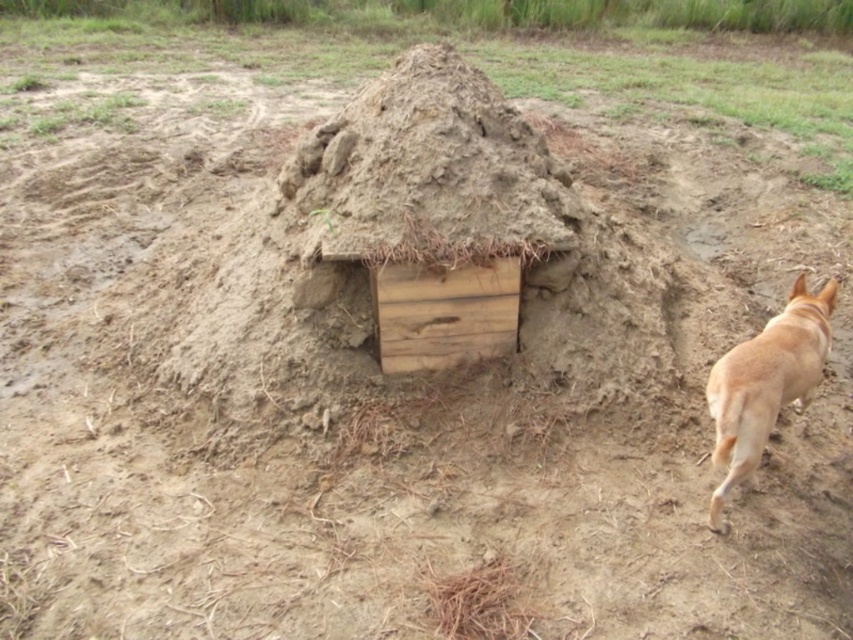
Between point (428, 93) and point (740, 385), which one is positioned behind?

The point (428, 93) is more distant.

Can you confirm if clayey dirt mound at center is positioned below brown furry dog at right?

No.

Where is `clayey dirt mound at center`? clayey dirt mound at center is located at coordinates (428, 172).